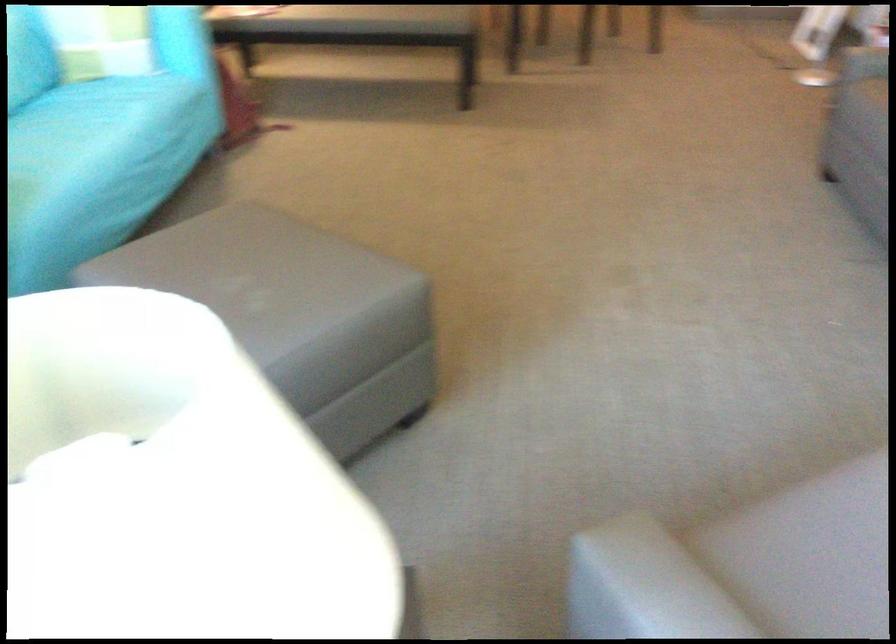
I want to click on blue sofa sitting surface, so click(87, 134).